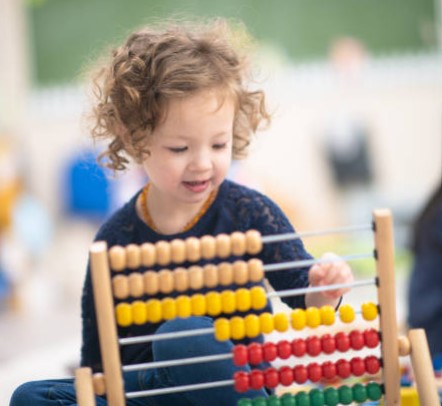
You are a GUI agent. You are given a task and a screenshot of the screen. Output one action in this format:
    pyautogui.click(x=<x>, y=<y>)
    Task: Click on the abacus bead in seventh row down
    This screenshot has width=442, height=406.
    Given the screenshot: What is the action you would take?
    pyautogui.click(x=244, y=402), pyautogui.click(x=261, y=399), pyautogui.click(x=272, y=399), pyautogui.click(x=286, y=399), pyautogui.click(x=308, y=396), pyautogui.click(x=318, y=396), pyautogui.click(x=332, y=397), pyautogui.click(x=342, y=397), pyautogui.click(x=359, y=396), pyautogui.click(x=372, y=392)